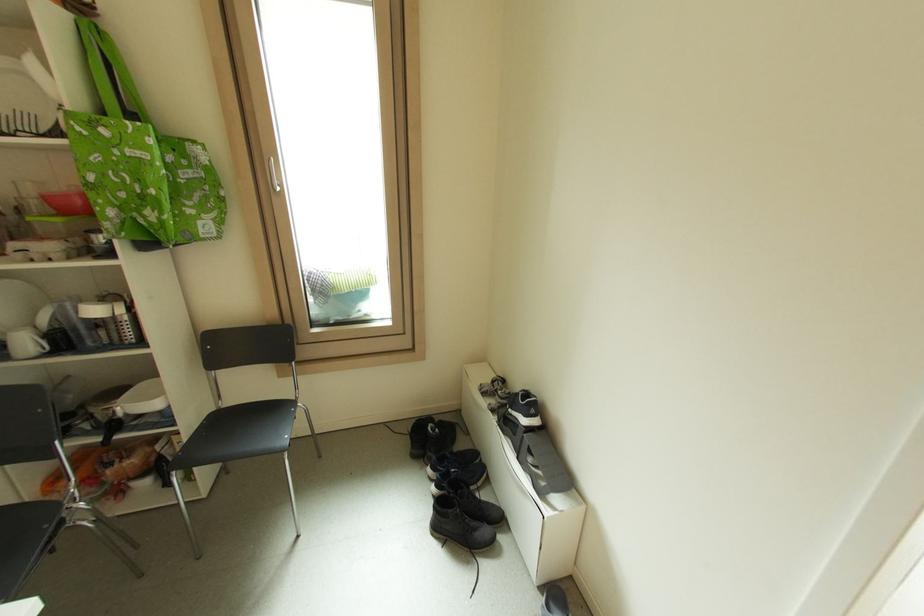
What do you see at coordinates (273, 176) in the screenshot? I see `a silver window handle` at bounding box center [273, 176].